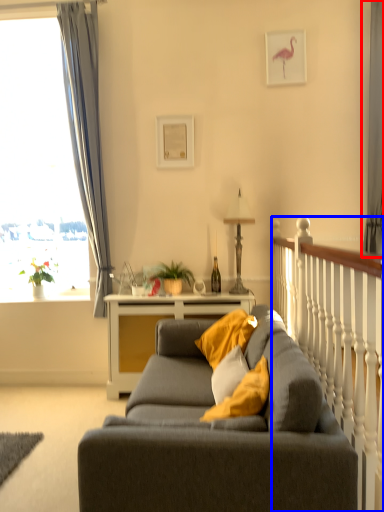
Question: Among these objects, which one is farthest to the camera, curtain (highlighted by a red box) or rail (highlighted by a blue box)?

Choices:
 (A) curtain
 (B) rail

Answer: (A)